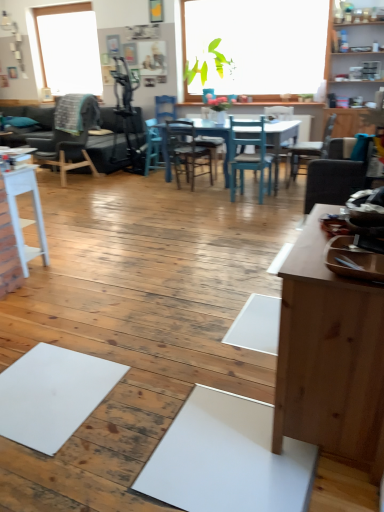
Where is `wooden cabinet at upper right`? The width and height of the screenshot is (384, 512). wooden cabinet at upper right is located at coordinates (348, 71).

What do you see at coordinates (249, 156) in the screenshot? This screenshot has width=384, height=512. I see `teal wood chair at center, the fourth chair from the left` at bounding box center [249, 156].

What are the coordinates of `suede-like gray chair at right, arranged as the second chair when viewed from the right` in the screenshot? It's located at (335, 175).

In order to click on dark gray leather couch at left in this screenshot , I will do `click(108, 144)`.

In order to click on wooden chair at center, which ranks as the third chair in left-to-right order in this screenshot , I will do `click(166, 127)`.

At what (x,y) coordinates should I click in order to perform the action: click on the 5th chair in front of the dark gray leather couch at left. Please return your answer as a coordinate pair (x, y). This screenshot has width=384, height=512. Looking at the image, I should click on (249, 156).

Considering their positions, is teal wood chair at center, the fourth chair from the left, located in front of or behind dark gray leather couch at left?

teal wood chair at center, the fourth chair from the left, is in front of dark gray leather couch at left.

Can dark gray leather couch at left be found inside teal wood chair at center, the fourth chair from the left?

No, dark gray leather couch at left is not inside teal wood chair at center, the fourth chair from the left.

Between white matte table at left and wooden chair at center, the fourth chair viewed from the right, which one has larger width?

Wider between the two is wooden chair at center, the fourth chair viewed from the right.

Are white matte table at left and wooden chair at center, which ranks as the third chair in left-to-right order, located far from each other?

Yes, white matte table at left and wooden chair at center, which ranks as the third chair in left-to-right order, are located far from each other.

Is white matte table at left facing towards wooden chair at center, which ranks as the third chair in left-to-right order?

Yes.

Considering the sizes of objects white matte table at left and wooden chair at center, the fourth chair viewed from the right, in the image provided, who is smaller, white matte table at left or wooden chair at center, the fourth chair viewed from the right,?

Smaller between the two is white matte table at left.

Locate an element on the screen. The width and height of the screenshot is (384, 512). chair that is the 3rd object above the blue wood chair at center, marked as the 2th chair in a left-to-right arrangement (from a real-world perspective) is located at coordinates (249, 156).

Is blue wood chair at center, which is the fifth chair in right-to-left order, next to teal wood chair at center, placed as the third chair when sorted from right to left, and touching it?

No, blue wood chair at center, which is the fifth chair in right-to-left order, is not making contact with teal wood chair at center, placed as the third chair when sorted from right to left.

Which of these two, blue wood chair at center, marked as the 2th chair in a left-to-right arrangement, or teal wood chair at center, placed as the third chair when sorted from right to left, is smaller?

Smaller between the two is blue wood chair at center, marked as the 2th chair in a left-to-right arrangement.

Would you say blue wood chair at center, marked as the 2th chair in a left-to-right arrangement, is outside teal wood chair at center, placed as the third chair when sorted from right to left?

Yes.

The width and height of the screenshot is (384, 512). In order to click on desk on the right of dark gray leather couch at left in this screenshot , I will do `click(329, 356)`.

Considering the points (104, 153) and (325, 236), which point is behind, point (104, 153) or point (325, 236)?

Point (104, 153)

Is dark gray leather couch at left positioned beyond the bounds of light brown wood desk at right?

dark gray leather couch at left lies outside light brown wood desk at right's area.

Is dark gray leather couch at left aimed at light brown wood desk at right?

No, dark gray leather couch at left is not facing towards light brown wood desk at right.

Looking at this image, from a real-world perspective, which object stands above the other?

wooden cabinet at upper right is physically above.

Can you see wooden cabinet at upper right touching blue wood chair at center, which is the fifth chair in right-to-left order?

No, wooden cabinet at upper right is not beside blue wood chair at center, which is the fifth chair in right-to-left order.

From their relative heights in the image, would you say light brown wood desk at right is taller or shorter than wooden cabinet at upper right?

light brown wood desk at right is shorter than wooden cabinet at upper right.

From the image's perspective, is light brown wood desk at right under wooden cabinet at upper right?

Correct, light brown wood desk at right appears lower than wooden cabinet at upper right in the image.

Can you confirm if light brown wood desk at right is bigger than wooden cabinet at upper right?

No.

Is white matte table at left located within dark brown wooden chair at left, which is the first chair in left-to-right order?

No.

From a real-world perspective, between dark brown wooden chair at left, which is the first chair in left-to-right order, and white matte table at left, who is vertically higher?

dark brown wooden chair at left, which is the first chair in left-to-right order, from a real-world perspective.

Locate an element on the screen. The image size is (384, 512). table that is below the dark brown wooden chair at left, which is the first chair in left-to-right order (from the image's perspective) is located at coordinates (25, 219).

Where is `couch behind the teal wood chair at center, the fourth chair from the left`? Image resolution: width=384 pixels, height=512 pixels. couch behind the teal wood chair at center, the fourth chair from the left is located at coordinates (108, 144).

Where is `table on the left of wooden chair at center, the fourth chair viewed from the right`? table on the left of wooden chair at center, the fourth chair viewed from the right is located at coordinates (25, 219).

From the image, which object appears to be farther from suede-like gray chair at right, arranged as the second chair when viewed from the right, teal wood chair at center, placed as the third chair when sorted from right to left, or dark brown wooden chair at left, which is the first chair in left-to-right order?

dark brown wooden chair at left, which is the first chair in left-to-right order.

From the picture: When comparing their distances from wooden chair at center, the fourth chair viewed from the right, does dark gray leather couch at left or dark brown wooden chair at left, the sixth chair when ordered from right to left, seem further?

Based on the image, dark brown wooden chair at left, the sixth chair when ordered from right to left, appears to be further to wooden chair at center, the fourth chair viewed from the right.

In the scene shown: Estimate the real-world distances between objects in this image. Which object is further from dark gray leather couch at left, wooden chair at right, the 1th chair viewed from the right, or white matte table at left?

white matte table at left lies further to dark gray leather couch at left than the other object.

Based on their spatial positions, is blue wood chair at center, which is the fifth chair in right-to-left order, or dark brown wooden chair at left, which is the first chair in left-to-right order, further from wooden chair at center, the fourth chair viewed from the right?

dark brown wooden chair at left, which is the first chair in left-to-right order, is positioned further to the anchor wooden chair at center, the fourth chair viewed from the right.

Based on their spatial positions, is dark gray leather couch at left or blue wood chair at center, marked as the 2th chair in a left-to-right arrangement, closer to white matte table at left?

dark gray leather couch at left is positioned closer to the anchor white matte table at left.

From the picture: Estimate the real-world distances between objects in this image. Which object is closer to light brown wood desk at right, wooden cabinet at upper right or blue wood chair at center, which is the fifth chair in right-to-left order?

wooden cabinet at upper right.

Considering their positions, is wooden cabinet at upper right positioned further to wooden chair at center, the fourth chair viewed from the right, than wooden chair at right, the 6th chair positioned from the left?

Based on the image, wooden cabinet at upper right appears to be further to wooden chair at center, the fourth chair viewed from the right.

Based on the photo, when comparing their distances from blue wood chair at center, marked as the 2th chair in a left-to-right arrangement, does light brown wood desk at right or suede-like gray chair at right, acting as the 5th chair starting from the left, seem further?

Among the two, light brown wood desk at right is located further to blue wood chair at center, marked as the 2th chair in a left-to-right arrangement.

Where is `couch between dark brown wooden chair at left, which is the first chair in left-to-right order, and blue wood chair at center, which is the fifth chair in right-to-left order`? couch between dark brown wooden chair at left, which is the first chair in left-to-right order, and blue wood chair at center, which is the fifth chair in right-to-left order is located at coordinates (108, 144).

Identify the location of couch between dark brown wooden chair at left, the sixth chair when ordered from right to left, and suede-like gray chair at right, acting as the 5th chair starting from the left. This screenshot has height=512, width=384. click(x=108, y=144).

Identify the location of desk situated between white matte table at left and suede-like gray chair at right, arranged as the second chair when viewed from the right, from left to right. The width and height of the screenshot is (384, 512). click(329, 356).

Find the location of a particular element. This screenshot has height=512, width=384. table situated between dark gray leather couch at left and wooden chair at right, the 1th chair viewed from the right, from left to right is located at coordinates (25, 219).